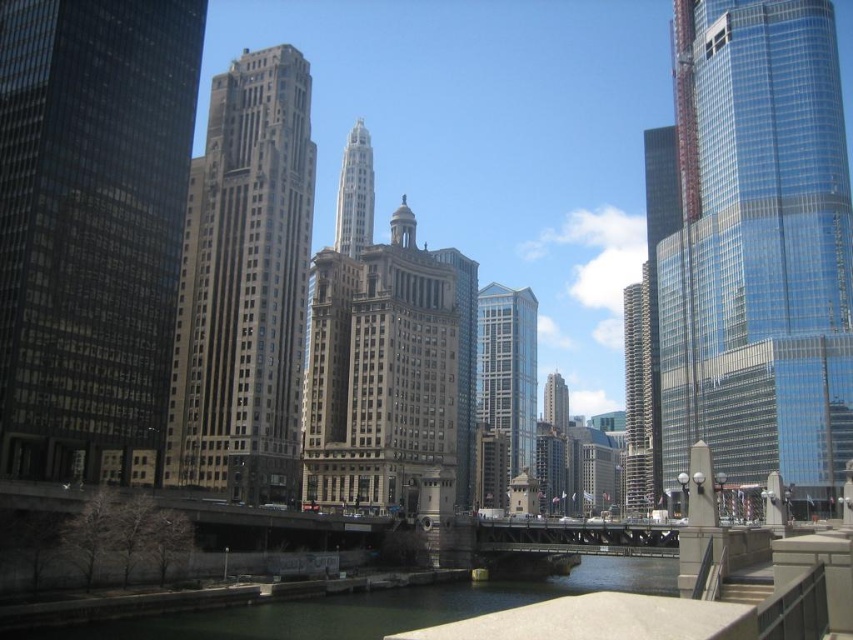
You are an architect analyzing the urban skyline. You observe the matte glass skyscraper at left and the gray stone tower at center. Which building has a larger footprint in terms of width?

The matte glass skyscraper at left is bigger than the gray stone tower at center, so the matte glass skyscraper at left has a larger footprint in terms of width.

You are standing at the center of the pedestrian walkway on the bridge. Which direction should you look to see the matte glass skyscraper at left?

You should look to the left to see the matte glass skyscraper at left, as it is located at point (90, 225) which is to the left side of the scene.

In the scene shown: You are an architect evaluating the urban skyline. You need to determine which of the two buildings, the transparent glass skyscraper at right or the gold textured building at center, has a greater height. Based on the scene, which one is taller?

The transparent glass skyscraper at right is taller than the gold textured building at center according to the description.